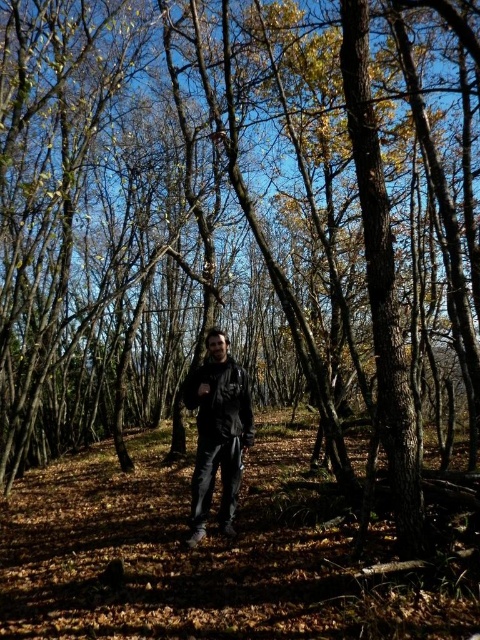
Between point (219, 509) and point (190, 401), which one is positioned in front?

Point (190, 401)

Between matte black jacket at center and leather jacket at center, which one appears on the left side from the viewer's perspective?

matte black jacket at center is more to the left.

Image resolution: width=480 pixels, height=640 pixels. I want to click on matte black jacket at center, so click(217, 433).

Locate an element on the screen. This screenshot has height=640, width=480. matte black jacket at center is located at coordinates (217, 433).